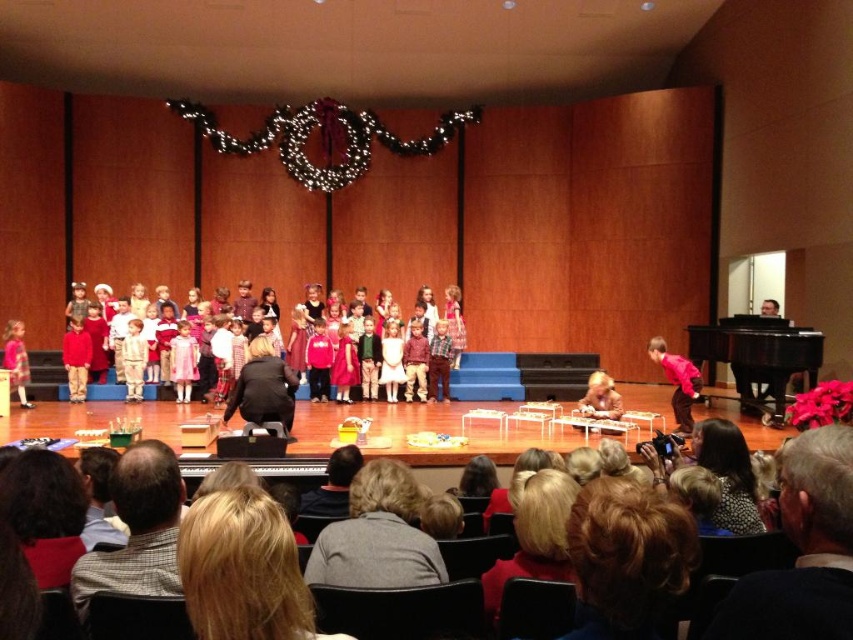
You are a stagehand preparing to move the black polished piano at right. There is a narrow doorway to the left of the dressy red skirts at center that is only 1.2 meters wide. Can the piano fit through the doorway?

The black polished piano at right has a width less than the dressy red skirts at center. However, the width of the dressy red skirts at center is not provided. Therefore, it is impossible to determine if the piano can fit through the 1.2 meter wide doorway based on the given information.

Looking at this image, you are standing at the center of the stage and see the point marked at coordinates (758,355). What object is located at that point?

The point at coordinates (758,355) marks the location of the black polished piano at right.

Looking at this image, you are standing on the stage and want to find the pink matte shirt at center. Based on the coordinates given, where should you look relative to the stage?

The pink matte shirt at center is located at coordinates approximately 60 percent from the left edge and 80 percent from the bottom edge of the stage.